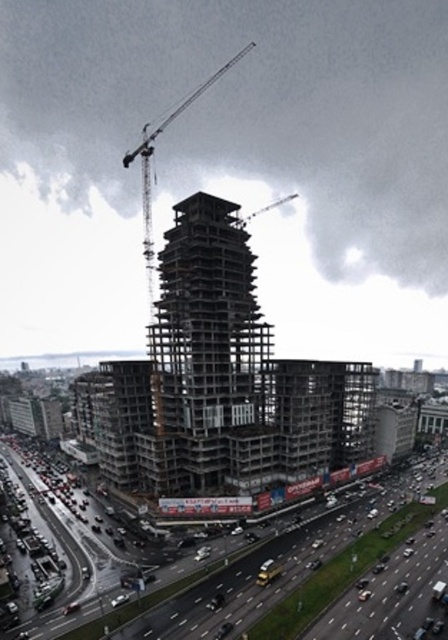
You are a construction worker needing to transport materials between the concrete structure at center and the metallic gray crane at center. Which object has a narrower width that might require careful maneuvering when moving materials?

The concrete structure at center has a narrower width than the metallic gray crane at center, so you should be cautious when maneuvering materials through that area.